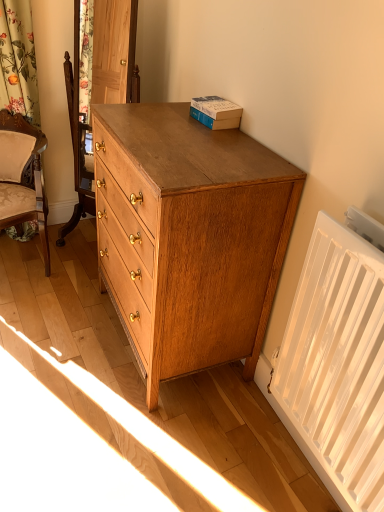
Locate an element on the screen. vacant space situated on the left part of matte oak chest of drawers at right is located at coordinates (64, 330).